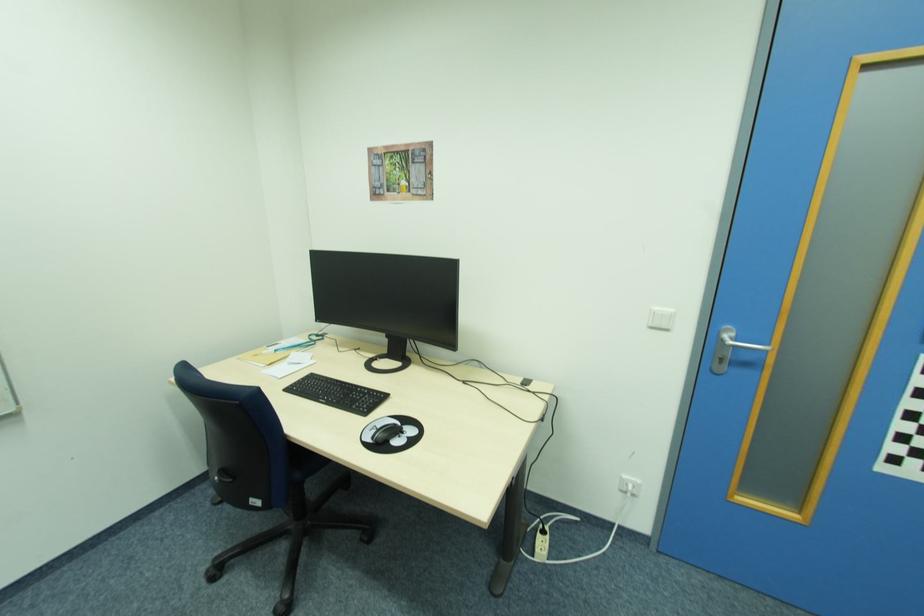
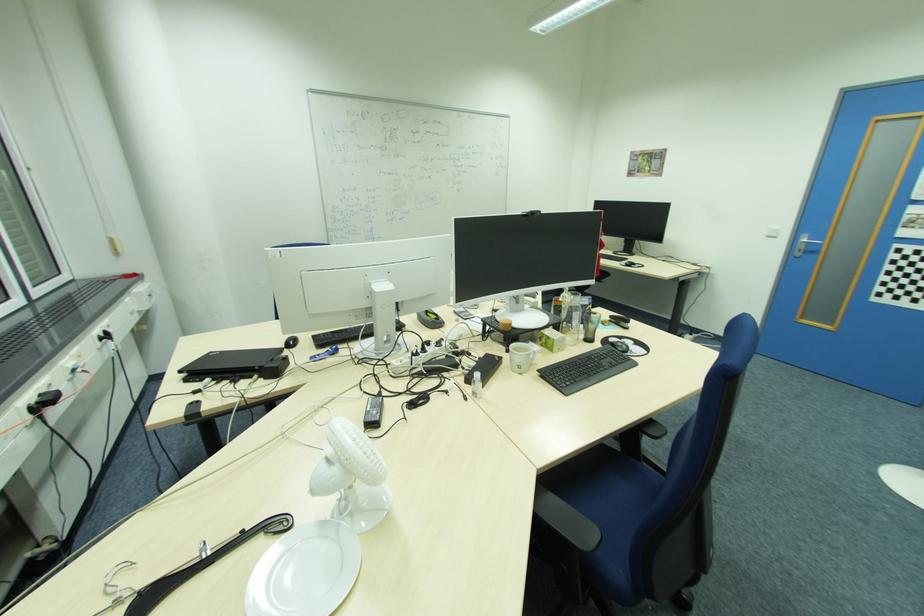
In the second image, find the point that corresponds to point 723,359 in the first image.

(804, 251)